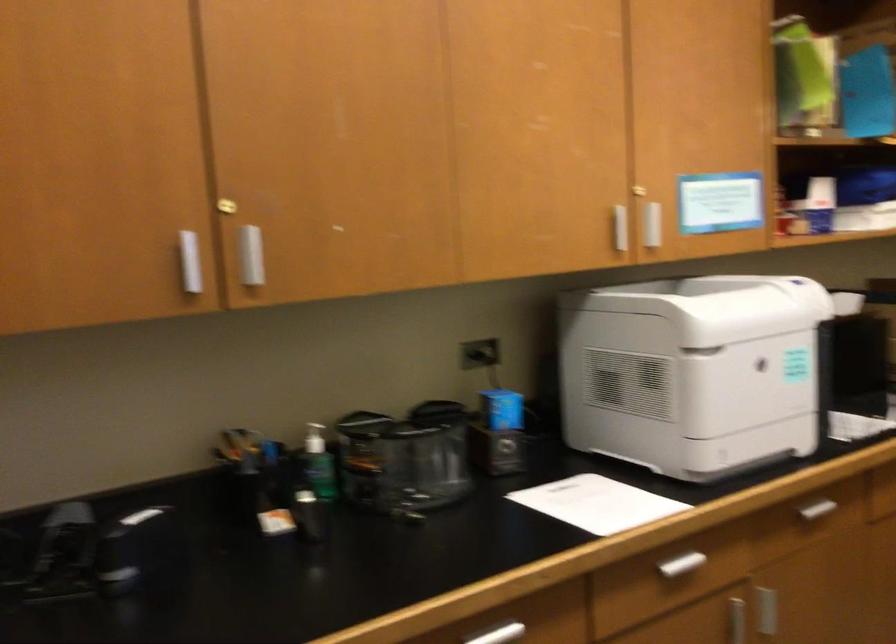
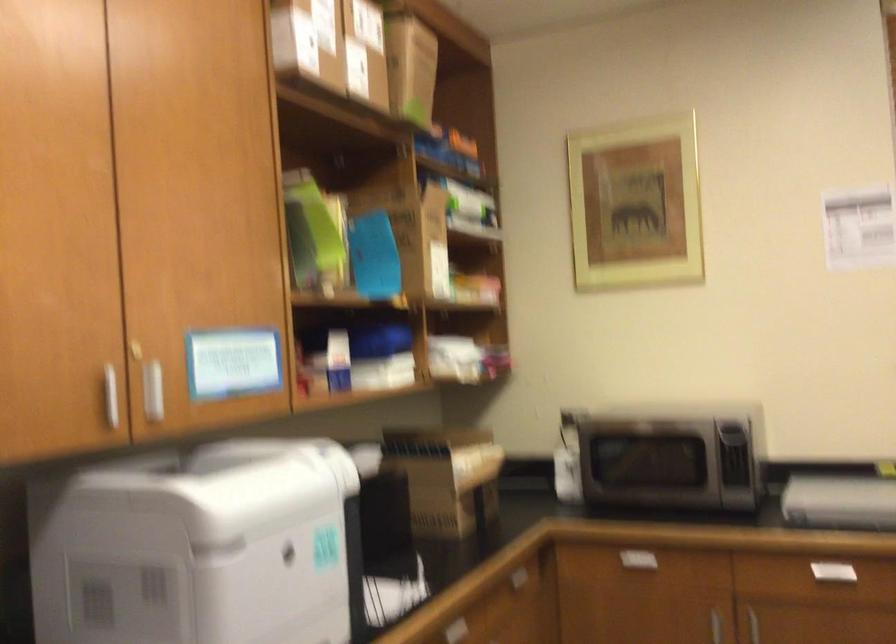
Locate, in the second image, the point that corresponds to pixel 648 225 in the first image.

(152, 391)